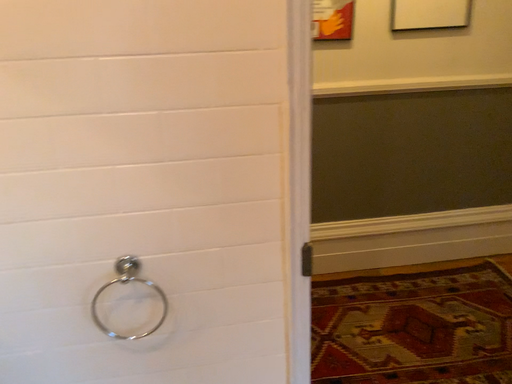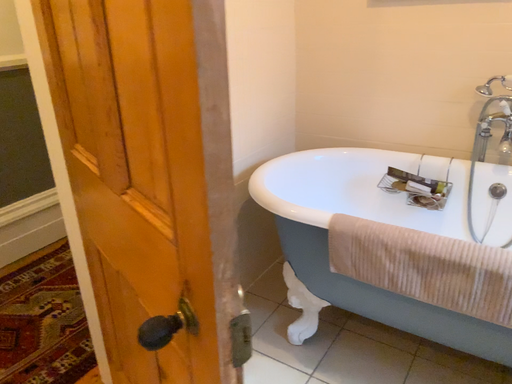
Question: How did the camera likely rotate when shooting the video?

Choices:
 (A) rotated upward
 (B) rotated downward

Answer: (A)